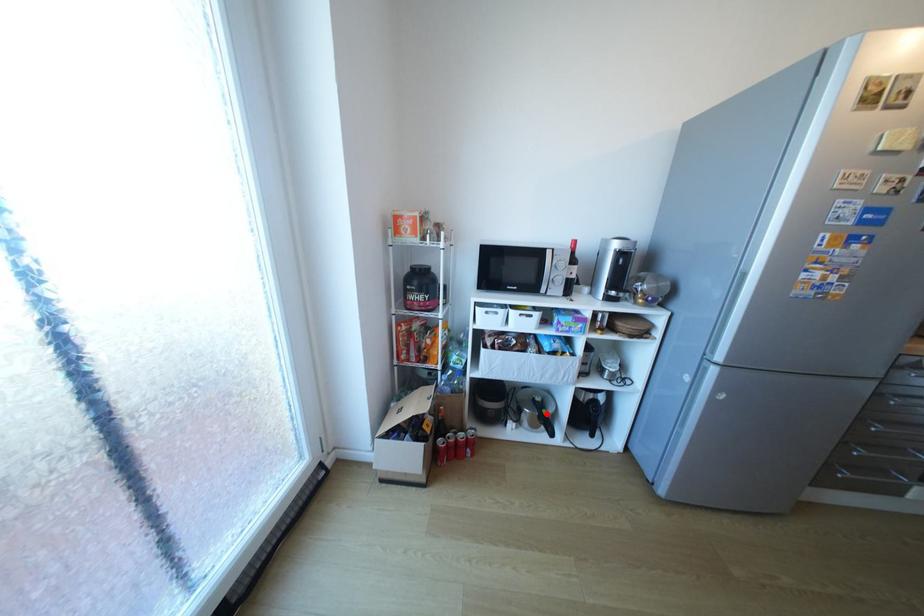
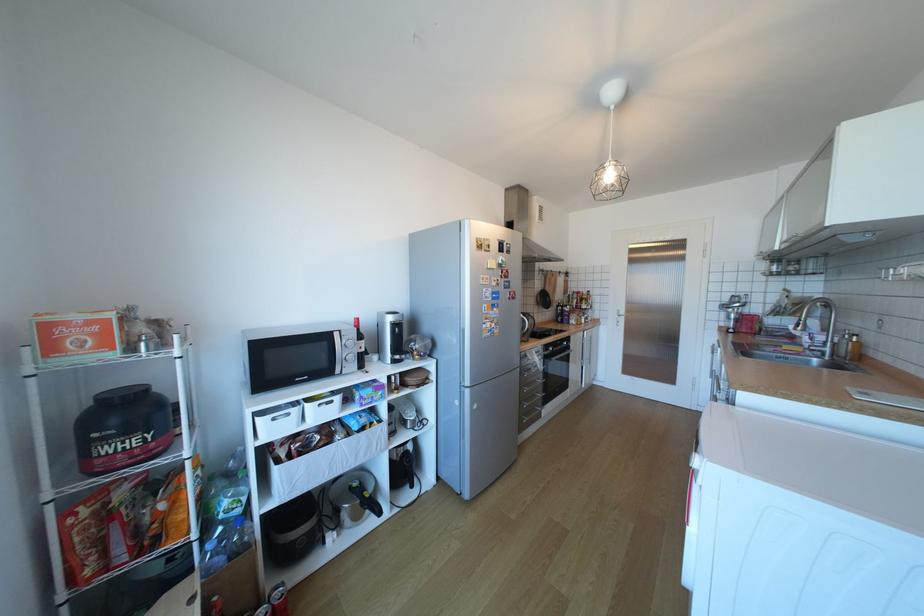
In the second image, find the point that corresponds to the highlighted location in the first image.

(369, 501)